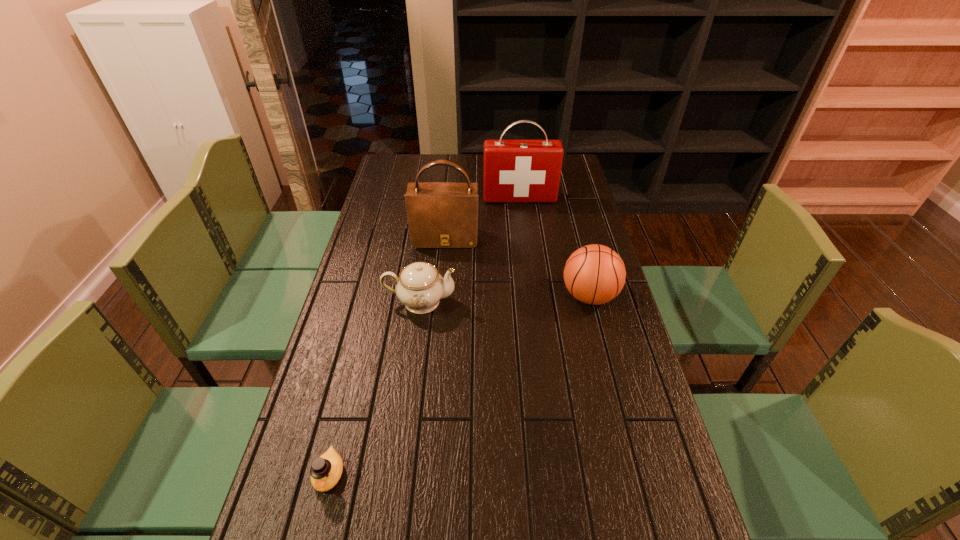
Find the location of a particular element. The image size is (960, 540). the farthest object is located at coordinates (515, 171).

Find the location of `shoulder bag`. shoulder bag is located at coordinates (440, 214).

Find the location of a particular element. basketball is located at coordinates (594, 274).

In order to click on chinaware in this screenshot , I will do `click(420, 286)`.

Where is `duck`? The height and width of the screenshot is (540, 960). duck is located at coordinates (325, 471).

Locate an element on the screen. The image size is (960, 540). the nearest object is located at coordinates (325, 471).

In order to click on vacant space located 0.230m on the front face of the farthest object in this screenshot , I will do point(525,240).

Image resolution: width=960 pixels, height=540 pixels. Find the location of `blank area located 0.270m on the front flap of the shoulder bag`. blank area located 0.270m on the front flap of the shoulder bag is located at coordinates (439, 306).

At what (x,y) coordinates should I click in order to perform the action: click on free region located 0.190m on the left of the third shortest object. Please return your answer as a coordinate pair (x, y). Looking at the image, I should click on (500, 296).

Where is `vacant space located 0.080m at the spout of the chinaware`? This screenshot has height=540, width=960. vacant space located 0.080m at the spout of the chinaware is located at coordinates (482, 301).